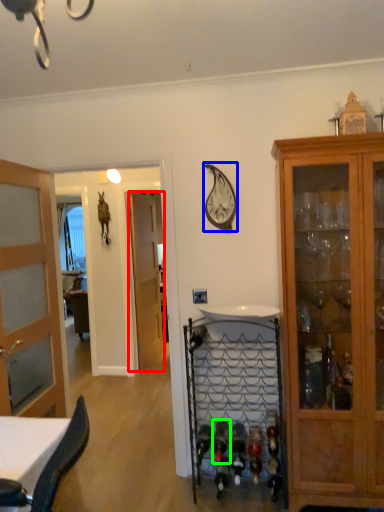
Question: Which is nearer to the door (highlighted by a red box)? clock (highlighted by a blue box) or wine bottle (highlighted by a green box).

Choices:
 (A) clock
 (B) wine bottle

Answer: (B)